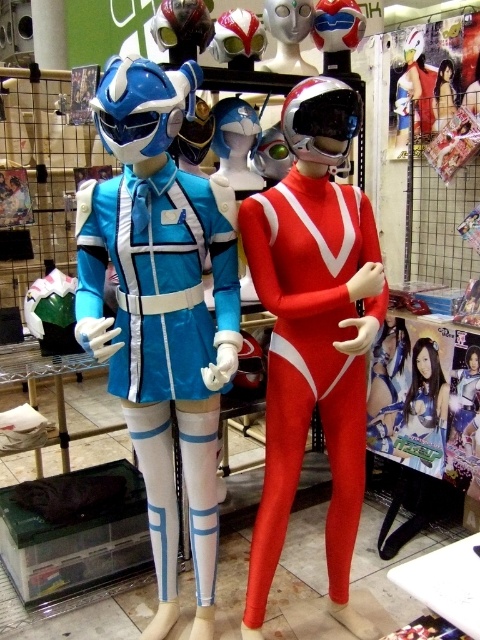
Which is in front, point (344, 573) or point (162, 4)?

Point (344, 573)

Locate an element on the screen. The height and width of the screenshot is (640, 480). shiny red spandex suit at center is located at coordinates (313, 332).

Is matte plastic helmet at center below blue glossy helmet at center?

Yes, matte plastic helmet at center is below blue glossy helmet at center.

Can you confirm if matte plastic helmet at center is bigger than blue glossy helmet at center?

Yes, matte plastic helmet at center is bigger than blue glossy helmet at center.

Locate an element on the screen. matte plastic helmet at center is located at coordinates click(288, 35).

Where is `matte plastic helmet at center`? matte plastic helmet at center is located at coordinates (288, 35).

Between shiny silver armor at center and shiny silver helmet at center, which one has more height?

shiny silver armor at center is taller.

Can you confirm if shiny silver armor at center is shorter than shiny silver helmet at center?

No.

Measure the distance between shiny silver armor at center and camera.

The distance of shiny silver armor at center from camera is 2.19 meters.

I want to click on shiny silver armor at center, so click(422, 426).